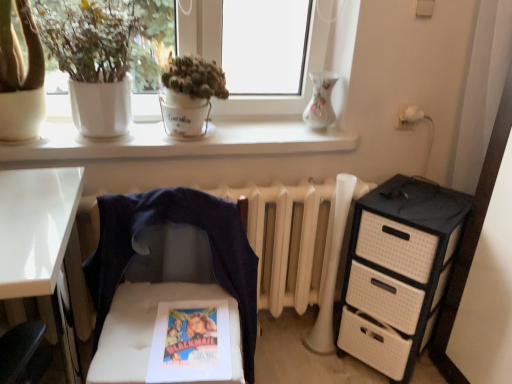
Question: Is white matte pot at upper left, marked as the second houseplant in a right-to-left arrangement, at the left side of black textured chest of drawers at right?

Choices:
 (A) yes
 (B) no

Answer: (A)

Question: Can you confirm if white matte pot at upper left, the first houseplant when ordered from left to right, is wider than black textured chest of drawers at right?

Choices:
 (A) yes
 (B) no

Answer: (B)

Question: Is white matte pot at upper left, marked as the second houseplant in a right-to-left arrangement, positioned before black textured chest of drawers at right?

Choices:
 (A) no
 (B) yes

Answer: (B)

Question: Can you confirm if white matte pot at upper left, marked as the second houseplant in a right-to-left arrangement, is bigger than black textured chest of drawers at right?

Choices:
 (A) yes
 (B) no

Answer: (B)

Question: Is black textured chest of drawers at right at the back of white matte pot at upper left, the first houseplant when ordered from left to right?

Choices:
 (A) yes
 (B) no

Answer: (B)

Question: From the image's perspective, is white matte pot at upper left, marked as the second houseplant in a right-to-left arrangement, beneath black textured chest of drawers at right?

Choices:
 (A) yes
 (B) no

Answer: (B)

Question: Does white matte pot at upper left, the first houseplant when ordered from left to right, have a lesser width compared to matte paper comic book at center?

Choices:
 (A) no
 (B) yes

Answer: (A)

Question: Does white matte pot at upper left, marked as the second houseplant in a right-to-left arrangement, have a smaller size compared to matte paper comic book at center?

Choices:
 (A) yes
 (B) no

Answer: (B)

Question: Is matte paper comic book at center completely or partially inside white matte pot at upper left, the first houseplant when ordered from left to right?

Choices:
 (A) yes
 (B) no

Answer: (B)

Question: Is white matte pot at upper left, marked as the second houseplant in a right-to-left arrangement, further to the viewer compared to matte paper comic book at center?

Choices:
 (A) no
 (B) yes

Answer: (B)

Question: Does white matte pot at upper left, the first houseplant when ordered from left to right, have a lesser height compared to matte paper comic book at center?

Choices:
 (A) no
 (B) yes

Answer: (A)

Question: Does white matte pot at upper left, the first houseplant when ordered from left to right, have a greater width compared to matte paper comic book at center?

Choices:
 (A) no
 (B) yes

Answer: (B)

Question: From a real-world perspective, is green matte pot at upper center, which is the 1th houseplant from right to left, located beneath porcelain vase at upper center?

Choices:
 (A) yes
 (B) no

Answer: (B)